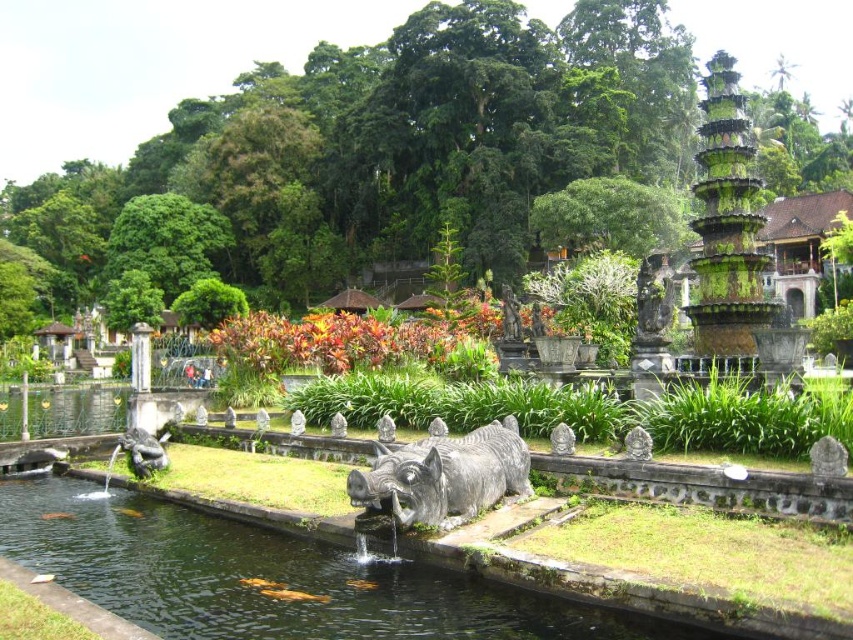
You are a visitor in the garden and want to know which object is taller between the smooth stone pond at center and the gray stone statue at center. Can you tell me which one is taller?

The smooth stone pond at center is taller than the gray stone statue at center.

You are a landscape architect designing a new garden. You need to place a decorative rock that is 2 meters wide between the smooth stone pond at center and the gray stone statue at center. Based on their widths, will the rock fit between them?

The smooth stone pond at center is wider than the gray stone statue at center. Since the decorative rock is 2 meters wide, it depends on the actual widths of the pond and statue. However, without specific measurements, we cannot confirm if the rock will fit between them.

You are a visitor in this garden and want to take a photo of both the smooth stone pond at center and the gray stone statue at center. Since you have a wide angle lens, which object should you focus on to ensure both are in the frame without needing to zoom in?

The smooth stone pond at center is larger in size than the gray stone statue at center, so you should focus on the gray stone statue at center to include both in the frame without zooming in.